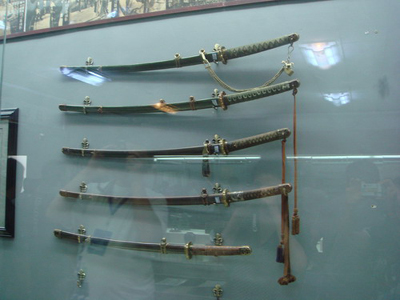
Locate an element on the screen. The height and width of the screenshot is (300, 400). cover is located at coordinates (124, 68).